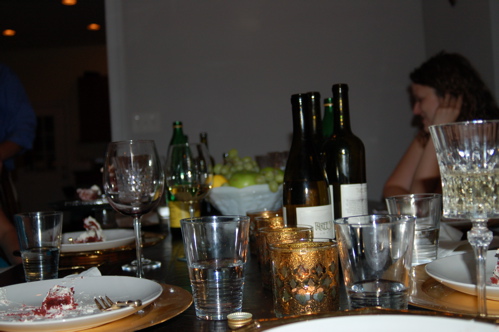
The height and width of the screenshot is (332, 499). Find the location of `light switch`. light switch is located at coordinates (136, 121), (143, 122), (151, 121).